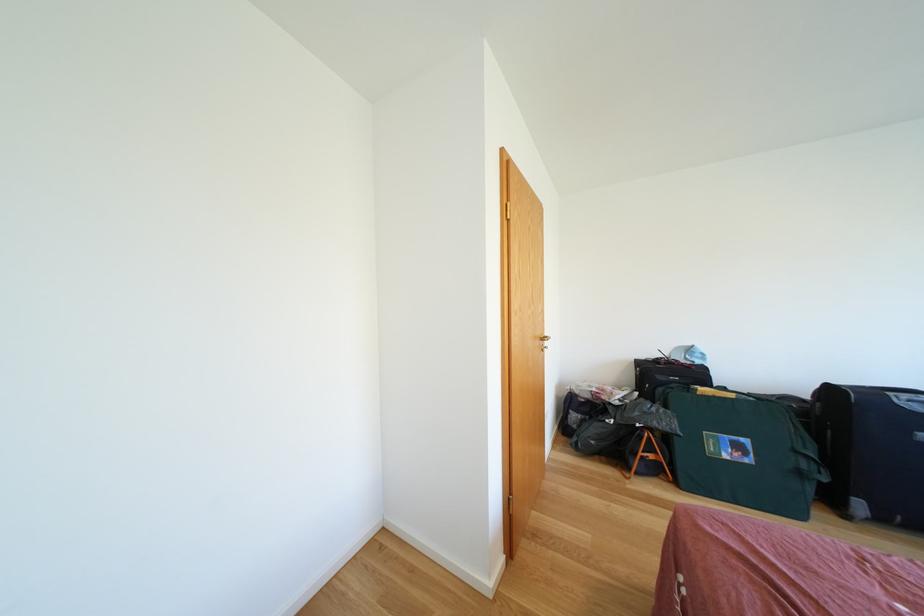
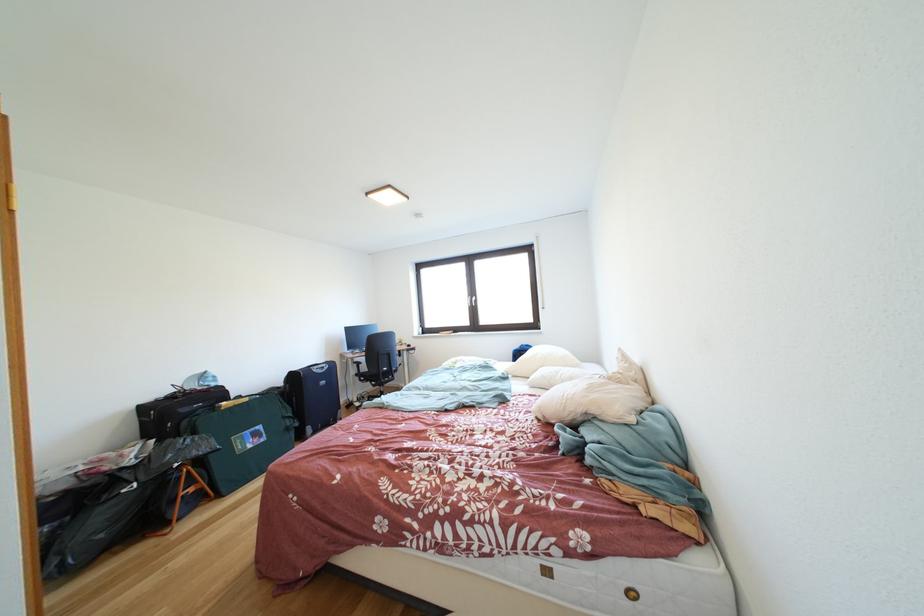
Find the pixel in the second image that matches pixel 706 367 in the first image.

(222, 389)